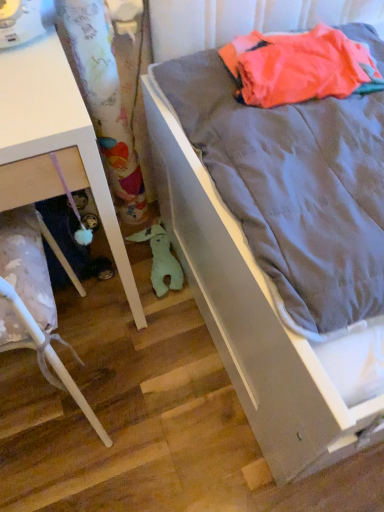
Where is `vacant location below white glossy drawer at lower left, which is counted as the first furniture, starting from the bottom (from a real-world perspective)`? vacant location below white glossy drawer at lower left, which is counted as the first furniture, starting from the bottom (from a real-world perspective) is located at coordinates click(46, 411).